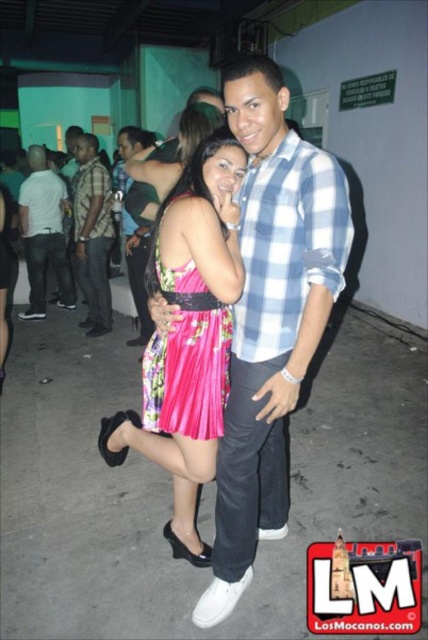
Which is more to the left, white matte shirt at left or brushed metal shirt at left?

Positioned to the left is white matte shirt at left.

Looking at this image, between white matte shirt at left and brushed metal shirt at left, which one has more height?

brushed metal shirt at left is taller.

This screenshot has width=428, height=640. I want to click on white matte shirt at left, so click(x=44, y=234).

Does blue checkered shirt at center appear under white matte shirt at left?

Yes.

The width and height of the screenshot is (428, 640). I want to click on blue checkered shirt at center, so click(x=270, y=317).

Between blue checkered shirt at center and pink floral dress at center, which one is positioned lower?

blue checkered shirt at center is below.

Does point (332, 288) come closer to viewer compared to point (201, 148)?

Yes, point (332, 288) is closer to viewer.

Find the location of a particular element. This screenshot has height=640, width=428. blue checkered shirt at center is located at coordinates (270, 317).